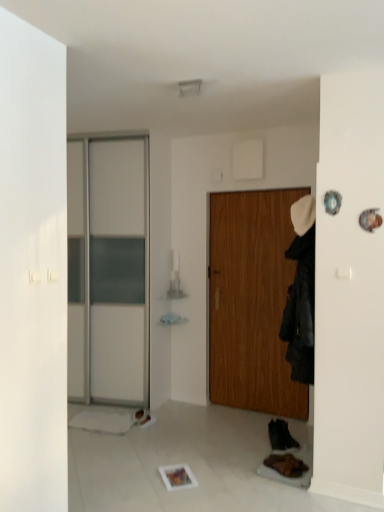
Locate an element on the screen. vacant location behind white leather shoe at lower center, which ranks as the 1th shoe in left-to-right order is located at coordinates (158, 412).